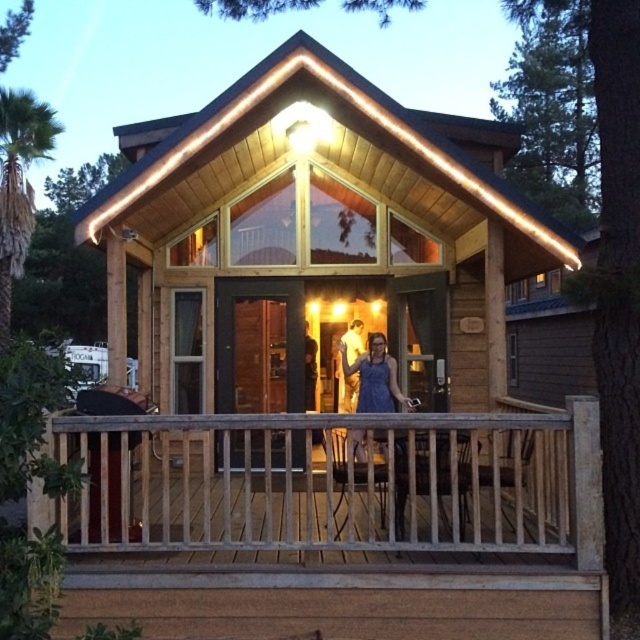
Question: Does weathered wood porch at center appear over matte blue dress at center?

Choices:
 (A) yes
 (B) no

Answer: (B)

Question: Which point is closer to the camera?

Choices:
 (A) (573, 461)
 (B) (412, 154)
 (C) (355, 368)

Answer: (A)

Question: Is wooden cabin at center bigger than blue denim dress at center?

Choices:
 (A) yes
 (B) no

Answer: (B)

Question: Based on their relative distances, which object is farther from the blue denim dress at center?

Choices:
 (A) wooden cabin at center
 (B) weathered wood porch at center

Answer: (B)

Question: Can you confirm if wooden cabin at center is bigger than matte blue dress at center?

Choices:
 (A) yes
 (B) no

Answer: (B)

Question: Which is farther from the weathered wood porch at center?

Choices:
 (A) wooden cabin at center
 (B) matte blue dress at center

Answer: (B)